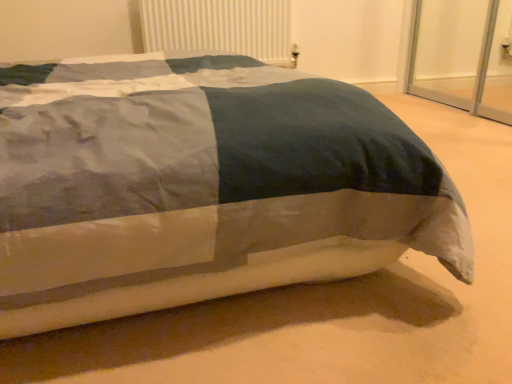
Question: Relative to textured cotton bed at center, is white plastic radiator at upper center in front or behind?

Choices:
 (A) front
 (B) behind

Answer: (B)

Question: In terms of height, does white plastic radiator at upper center look taller or shorter compared to textured cotton bed at center?

Choices:
 (A) short
 (B) tall

Answer: (B)

Question: From a real-world perspective, relative to textured cotton bed at center, is white plastic radiator at upper center vertically above or below?

Choices:
 (A) below
 (B) above

Answer: (B)

Question: From the image's perspective, is textured cotton bed at center above or below white plastic radiator at upper center?

Choices:
 (A) below
 (B) above

Answer: (A)

Question: Considering the positions of point (15, 322) and point (261, 36), is point (15, 322) closer or farther from the camera than point (261, 36)?

Choices:
 (A) farther
 (B) closer

Answer: (B)

Question: Would you say textured cotton bed at center is inside or outside white plastic radiator at upper center?

Choices:
 (A) inside
 (B) outside

Answer: (B)

Question: From their relative heights in the image, would you say textured cotton bed at center is taller or shorter than white plastic radiator at upper center?

Choices:
 (A) short
 (B) tall

Answer: (A)